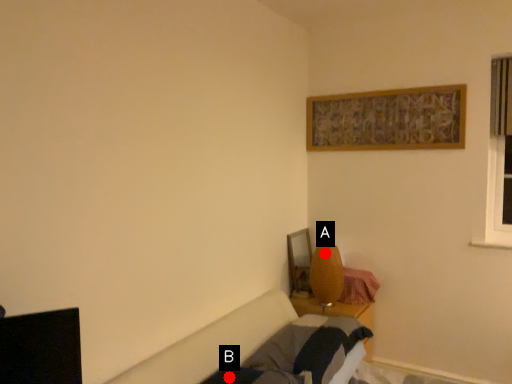
Question: Two points are circled on the image, labeled by A and B beside each circle. Among these points, which one is farthest from the camera?

Choices:
 (A) A is further
 (B) B is further

Answer: (A)